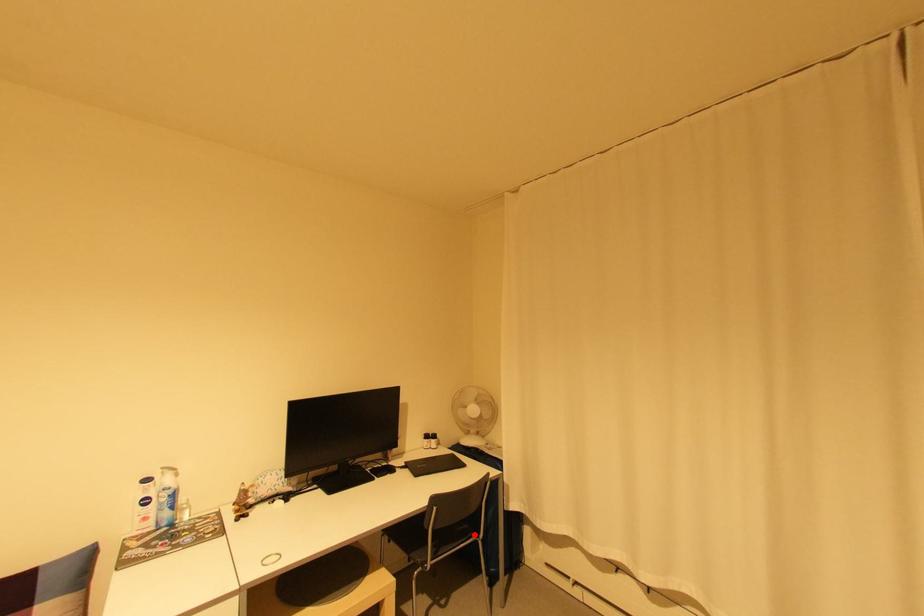
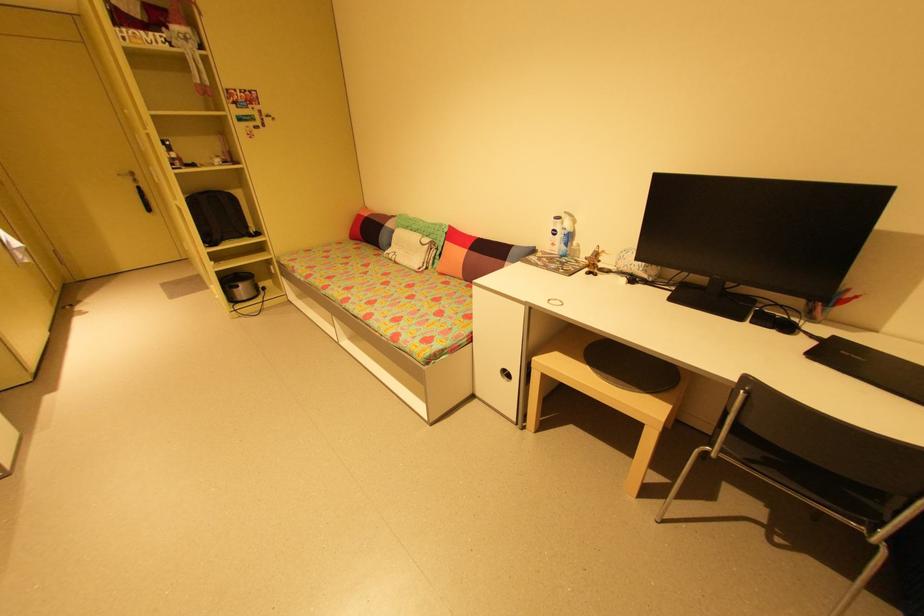
Question: I am providing you with two images of the same scene from different viewpoints. A red point is shown in image1. For the corresponding object point in image2, is it positioned nearer or farther from the camera?

Choices:
 (A) Nearer
 (B) Farther

Answer: (A)